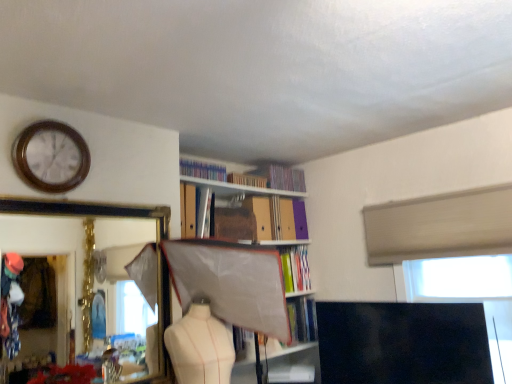
Question: Do you think hardcover books at upper center, the 2th book positioned from the top, is within woodenclock at upper left, or outside of it?

Choices:
 (A) outside
 (B) inside

Answer: (A)

Question: Does point (298, 180) appear closer or farther from the camera than point (58, 122)?

Choices:
 (A) farther
 (B) closer

Answer: (A)

Question: Based on their relative distances, which object is farther from the metallic silver book at upper center, acting as the 5th book starting from the top?

Choices:
 (A) white plastic window screen at upper right
 (B) hardcover book at center, the first book ordered from the bottom
 (C) hardcover books at upper center, acting as the seventh book starting from the bottom
 (D) matte cardboard book at upper center, the fifth book in the bottom-to-top sequence
 (E) matte plastic book at upper center, acting as the 6th book starting from the bottom

Answer: (A)

Question: Which object is positioned farthest from the white plastic window screen at upper right?

Choices:
 (A) hardcover book at center, the 7th book from the top
 (B) hardcover book at center, which ranks as the 8th book in top-to-bottom order
 (C) matte cardboard bookcase at center
 (D) metallic silver book at upper center, which appears as the fourth book when ordered from the bottom
 (E) hardcover books at upper center, marked as the first book in a top-to-bottom arrangement

Answer: (E)